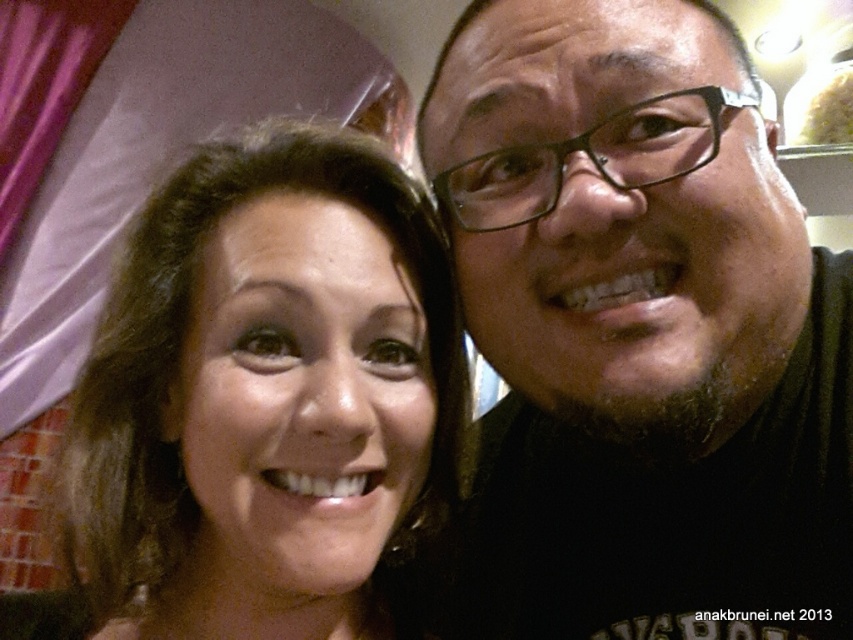
Question: Which of the following is the farthest from the observer?

Choices:
 (A) black matte glasses at upper right
 (B) matte brown hair at center

Answer: (A)

Question: Is black matte glasses at upper right smaller than matte brown hair at center?

Choices:
 (A) yes
 (B) no

Answer: (B)

Question: Which point is farther to the camera?

Choices:
 (A) matte brown hair at center
 (B) black matte glasses at upper right

Answer: (B)

Question: Can you confirm if black matte glasses at upper right is wider than matte brown hair at center?

Choices:
 (A) yes
 (B) no

Answer: (A)

Question: Is black matte glasses at upper right smaller than matte brown hair at center?

Choices:
 (A) yes
 (B) no

Answer: (B)